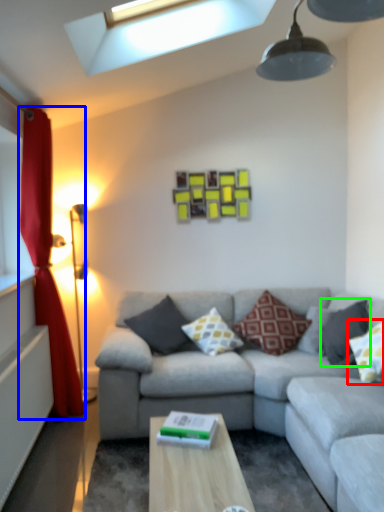
Question: Which object is the farthest from pillow (highlighted by a red box)? Choose among these: curtain (highlighted by a blue box) or pillow (highlighted by a green box).

Choices:
 (A) curtain
 (B) pillow

Answer: (A)